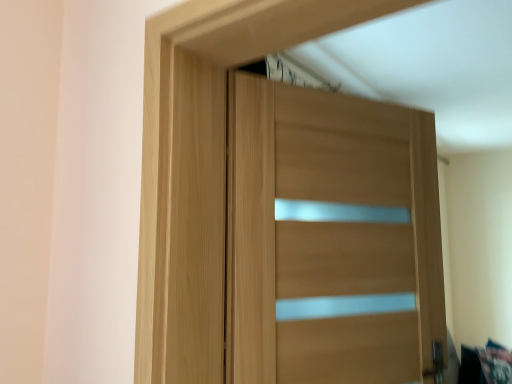
Image resolution: width=512 pixels, height=384 pixels. Identify the location of light brown wood door at center. (170, 120).

The height and width of the screenshot is (384, 512). What do you see at coordinates (170, 120) in the screenshot? I see `light brown wood door at center` at bounding box center [170, 120].

This screenshot has width=512, height=384. Find the location of `light brown wood door at center`. light brown wood door at center is located at coordinates (170, 120).